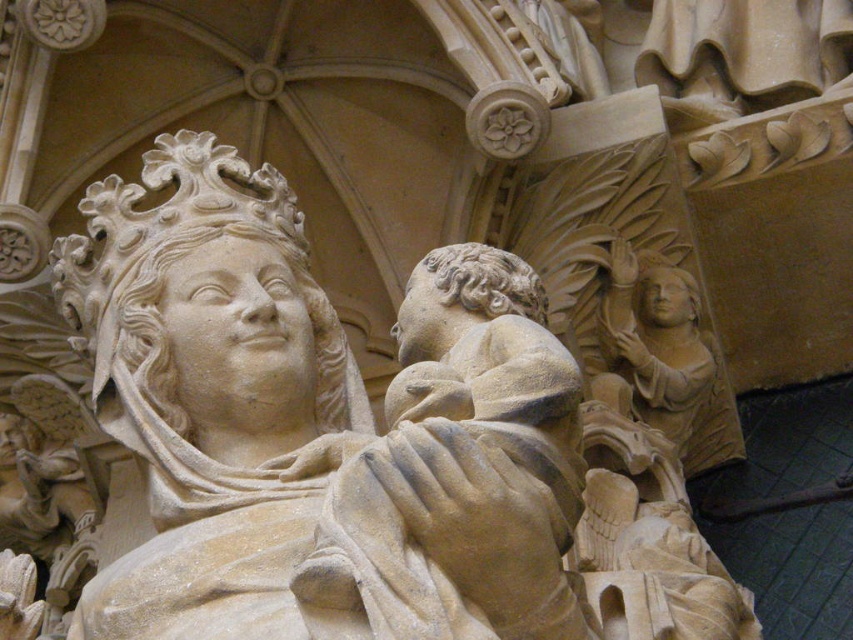
Based on the scene description, where is the stone statue of woman holding child at center located in terms of its 2D coordinates?

The stone statue of woman holding child at center is located at the 2D coordinates point (316, 428).

You are an art conservator examining the stone sculpture. You need to clean the stone statue of woman holding child at center and the beige stone angel at right. Which one should you clean first if you want to start with the one closer to the front?

The stone statue of woman holding child at center is in front of the beige stone angel at right, so you should clean the stone statue of woman holding child at center first since it is closer to the front.

You are an art conservator assessing the dimensions of the statues in the cathedral. Given that the beige stone angel at right is 2 meters wide, can you determine the minimum width of the stone statue of woman holding child at center?

The stone statue of woman holding child at center is wider than the beige stone angel at right, which is 2 meters wide. Therefore, the minimum width of the stone statue of woman holding child at center is greater than 2 meters.